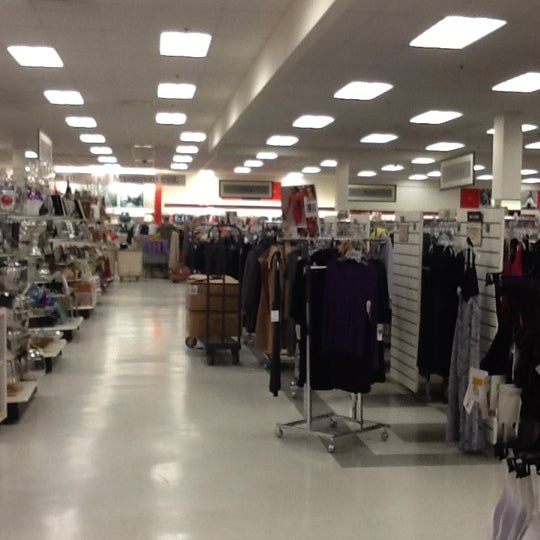
Identify the location of pillar. 508,167.